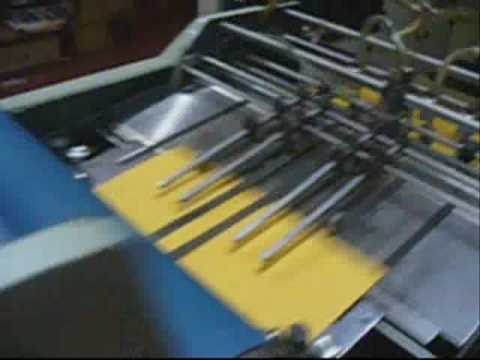
This screenshot has height=360, width=480. What are the coordinates of `rod` in the screenshot? It's located at (303, 223).